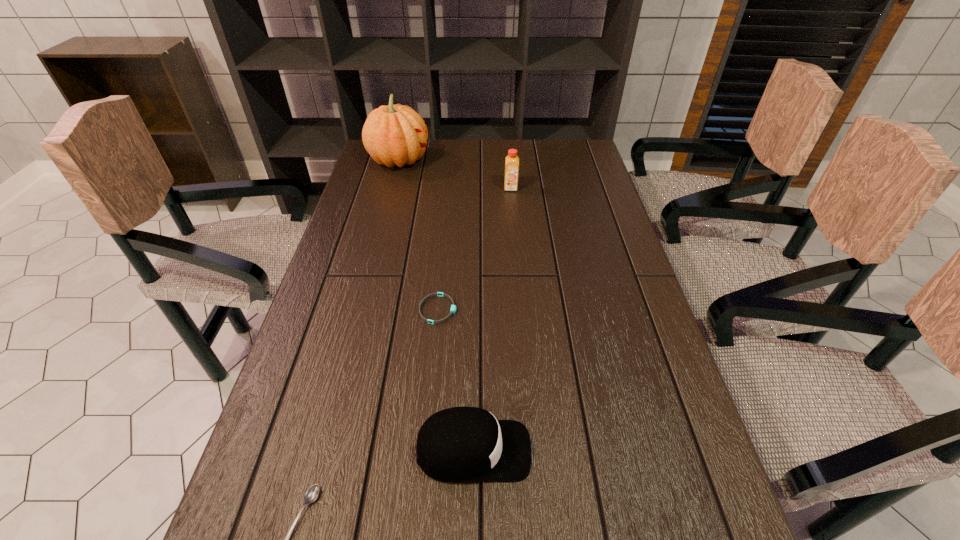
This screenshot has height=540, width=960. Identify the location of vacant region between the fourth nearest object and the pumpkin. (455, 174).

This screenshot has height=540, width=960. Find the location of `empty space that is in between the pumpkin and the third nearest object`. empty space that is in between the pumpkin and the third nearest object is located at coordinates (419, 235).

At what (x,y) coordinates should I click in order to perform the action: click on free space between the farthest object and the fourth tallest object. Please return your answer as a coordinate pair (x, y). Looking at the image, I should click on (419, 235).

Locate an element on the screen. empty location between the third tallest object and the third nearest object is located at coordinates pos(456,380).

Where is `vacant area that lies between the third tallest object and the tallest object`? The width and height of the screenshot is (960, 540). vacant area that lies between the third tallest object and the tallest object is located at coordinates (436, 306).

The height and width of the screenshot is (540, 960). Identify the location of vacant area between the wristband and the third tallest object. (456, 380).

You are a GUI agent. You are given a task and a screenshot of the screen. Output one action in this format:
    pyautogui.click(x=<x>, y=<y>)
    Task: Click on the free space between the second tallest object and the wristband
    The image size is (960, 540).
    Given the screenshot: What is the action you would take?
    pyautogui.click(x=474, y=249)

Identify which object is the closest to the third nearest object. Please provide its 2D coordinates. Your answer should be formatted as a tuple, i.e. [(x, y)], where the tuple contains the x and y coordinates of a point satisfying the conditions above.

[(460, 444)]

Choose which object is the second nearest neighbor to the nearest object. Please provide its 2D coordinates. Your answer should be formatted as a tuple, i.e. [(x, y)], where the tuple contains the x and y coordinates of a point satisfying the conditions above.

[(453, 307)]

You are a GUI agent. You are given a task and a screenshot of the screen. Output one action in this format:
    pyautogui.click(x=<x>, y=<y>)
    Task: Click on the vacant region that satisfies the following two spatial constraints: 1. on the front and back of the orange juice; 2. on the buckle of the wristband
    
    Given the screenshot: What is the action you would take?
    pyautogui.click(x=522, y=309)